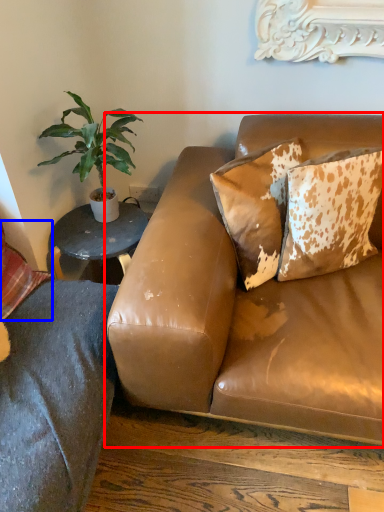
Question: Which point is further to the camera, studio couch (highlighted by a red box) or pillow (highlighted by a blue box)?

Choices:
 (A) studio couch
 (B) pillow

Answer: (B)